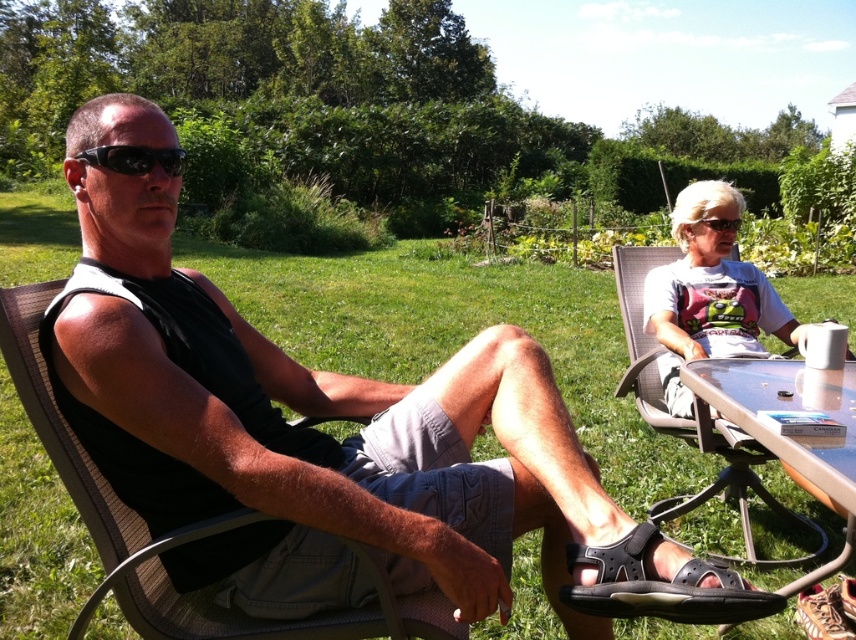
Who is higher up, transparent glass table at lower right or matte black goggles at upper right?

Positioned higher is matte black goggles at upper right.

Is transparent glass table at lower right closer to the viewer compared to matte black goggles at upper right?

That is True.

Where is `transparent glass table at lower right`? The width and height of the screenshot is (856, 640). transparent glass table at lower right is located at coordinates [x=782, y=435].

You are a GUI agent. You are given a task and a screenshot of the screen. Output one action in this format:
    pyautogui.click(x=<x>, y=<y>)
    Task: Click on the transparent glass table at lower right
    The width and height of the screenshot is (856, 640).
    Given the screenshot: What is the action you would take?
    pyautogui.click(x=782, y=435)

Is point (214, 397) positioned in front of point (724, 388)?

Yes, it is in front of point (724, 388).

What are the coordinates of `black fabric tank top at left` in the screenshot? It's located at (327, 436).

Is brown mesh chair at left wider than black rubber sandal at lower center?

Indeed, brown mesh chair at left has a greater width compared to black rubber sandal at lower center.

Can you confirm if brown mesh chair at left is positioned above black rubber sandal at lower center?

No.

Which is behind, point (144, 628) or point (664, 604)?

The point (144, 628) is more distant.

Identify the location of brown mesh chair at left. (175, 531).